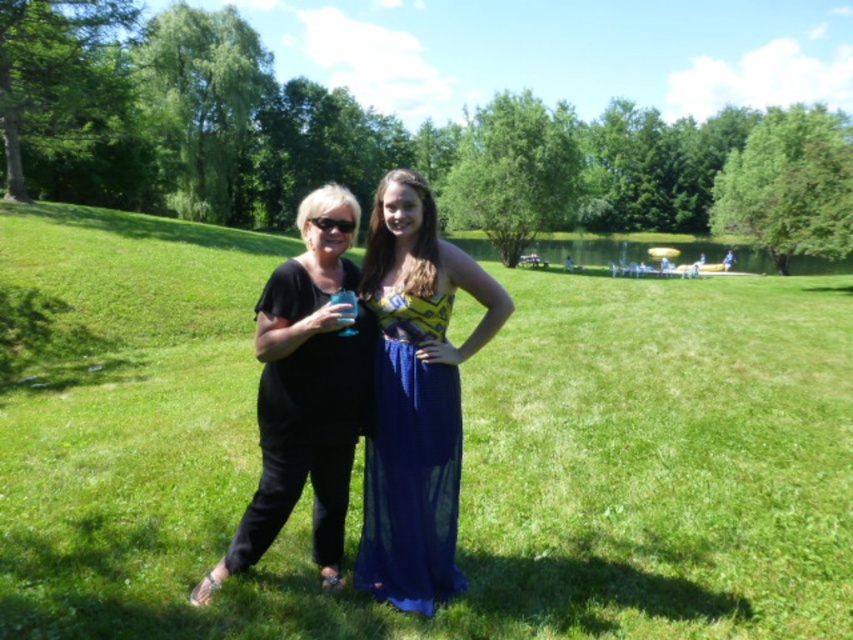
You are a photographer standing at the camera position. You want to take a photo of the black matte dress at center. However, there is a large tree blocking your view. The tree is 2.5 meters away from you. Can you move closer to the dress to get a clear shot without the tree blocking?

The black matte dress at center is 3.01 meters away from the camera. Since the tree is only 2.5 meters away, you can move forward 0.51 meters past the tree to get a clear view of the black matte dress at center.